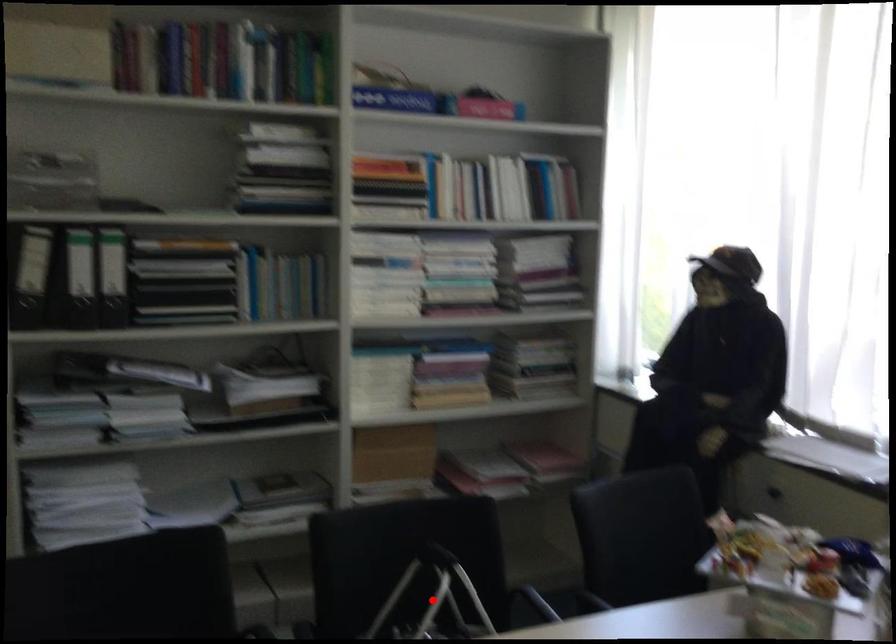
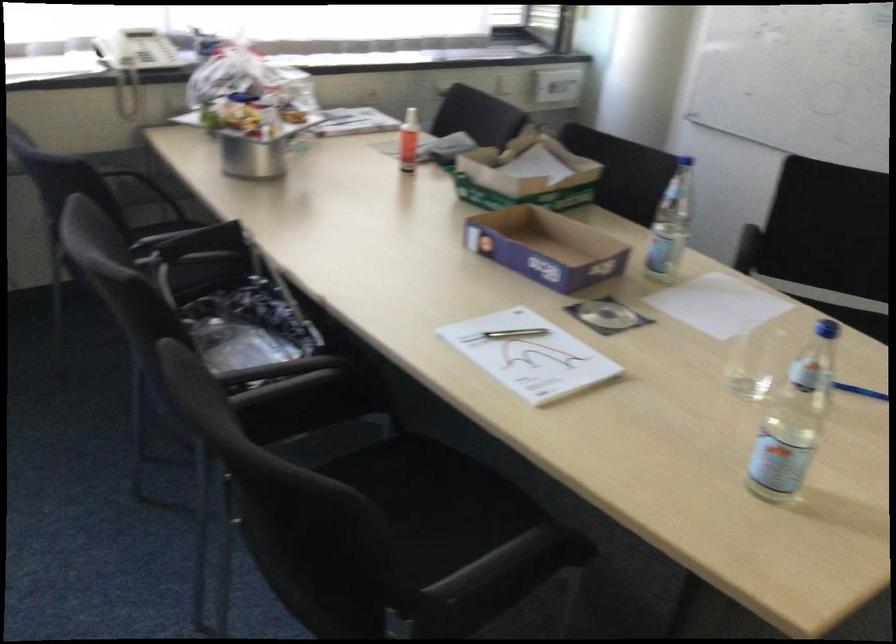
Question: I am providing you with two images of the same scene from different viewpoints. A red point is marked on the first image. Can you still see the location of the red point in image 2?

Choices:
 (A) Yes
 (B) No

Answer: (B)